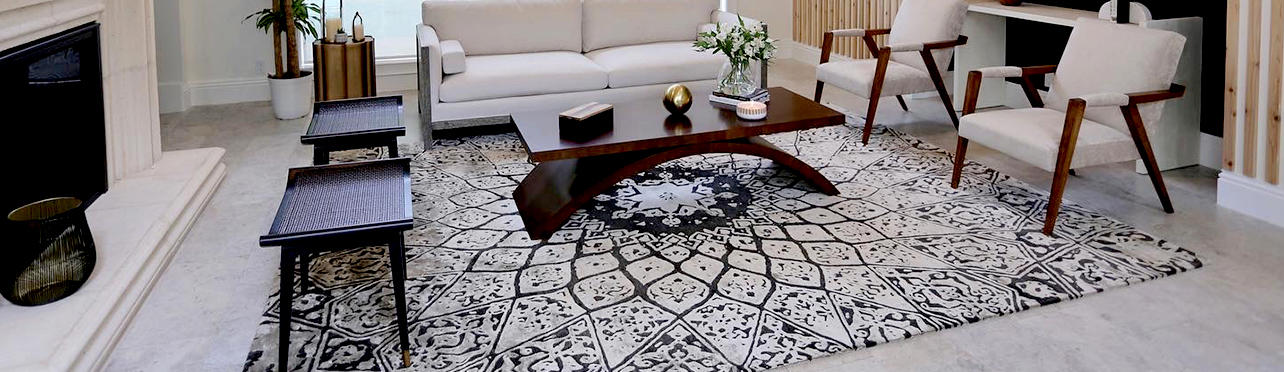
I want to click on fireplace, so click(50, 114).